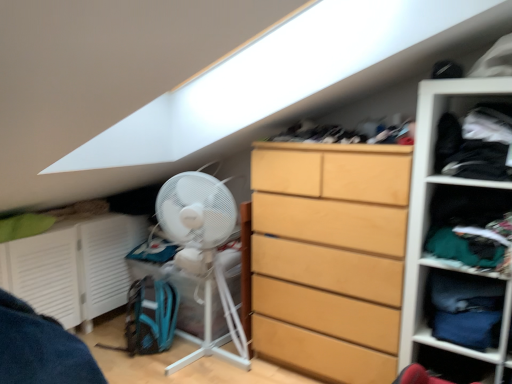
Question: Is dark blue fabric at upper right, placed as the 1th clothing when sorted from top to bottom, not inside white matte fan at lower left, the first cabinet when ordered from back to front?

Choices:
 (A) no
 (B) yes

Answer: (B)

Question: Is dark blue fabric at upper right, which ranks as the second clothing in bottom-to-top order, closer to camera compared to white matte fan at lower left, the 2th cabinet viewed from the front?

Choices:
 (A) yes
 (B) no

Answer: (A)

Question: Considering the relative sizes of dark blue fabric at upper right, placed as the 1th clothing when sorted from top to bottom, and white matte fan at lower left, the first cabinet when ordered from back to front, in the image provided, is dark blue fabric at upper right, placed as the 1th clothing when sorted from top to bottom, thinner than white matte fan at lower left, the first cabinet when ordered from back to front,?

Choices:
 (A) yes
 (B) no

Answer: (A)

Question: Does dark blue fabric at upper right, placed as the 1th clothing when sorted from top to bottom, touch white matte fan at lower left, the 2th cabinet viewed from the front?

Choices:
 (A) yes
 (B) no

Answer: (B)

Question: From the image's perspective, is dark blue fabric at upper right, placed as the 1th clothing when sorted from top to bottom, located beneath white matte fan at lower left, the 2th cabinet viewed from the front?

Choices:
 (A) yes
 (B) no

Answer: (B)

Question: Does point pyautogui.click(x=108, y=243) appear closer or farther from the camera than point pyautogui.click(x=375, y=127)?

Choices:
 (A) farther
 (B) closer

Answer: (A)

Question: Considering the positions of white matte fan at lower left, the 2th cabinet positioned from the right, and dark fabric laundry at upper center in the image, is white matte fan at lower left, the 2th cabinet positioned from the right, bigger or smaller than dark fabric laundry at upper center?

Choices:
 (A) small
 (B) big

Answer: (B)

Question: Is white matte fan at lower left, the first cabinet when ordered from back to front, in front of or behind dark fabric laundry at upper center in the image?

Choices:
 (A) behind
 (B) front

Answer: (A)

Question: From the image's perspective, is white matte fan at lower left, the 1th cabinet in the left-to-right sequence, positioned above or below dark fabric laundry at upper center?

Choices:
 (A) below
 (B) above

Answer: (A)

Question: From a real-world perspective, is white plastic fan at left physically located above or below white matte fan at lower left, the 2th cabinet viewed from the front?

Choices:
 (A) below
 (B) above

Answer: (B)

Question: In terms of size, does white plastic fan at left appear bigger or smaller than white matte fan at lower left, the 2th cabinet positioned from the right?

Choices:
 (A) big
 (B) small

Answer: (B)

Question: Does point (217, 226) appear closer or farther from the camera than point (37, 289)?

Choices:
 (A) farther
 (B) closer

Answer: (B)

Question: Is white plastic fan at left wider or thinner than white matte fan at lower left, the first cabinet when ordered from back to front?

Choices:
 (A) thin
 (B) wide

Answer: (B)

Question: Considering the positions of point pyautogui.click(x=254, y=226) and point pyautogui.click(x=203, y=223), is point pyautogui.click(x=254, y=226) closer or farther from the camera than point pyautogui.click(x=203, y=223)?

Choices:
 (A) farther
 (B) closer

Answer: (A)

Question: Is light wood dresser at center taller or shorter than white plastic fan at left?

Choices:
 (A) tall
 (B) short

Answer: (A)